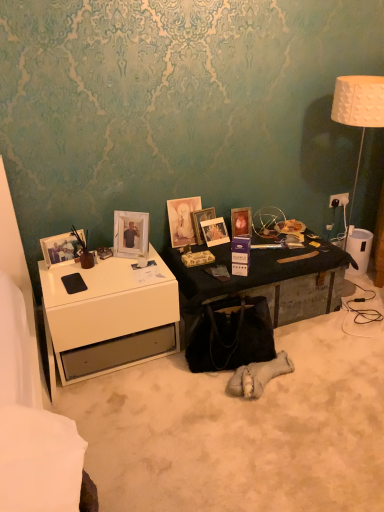
Question: Considering the positions of white plastic power outlet at upper right and matte glass picture frame at center, marked as the 3th picture frame in a left-to-right arrangement, in the image, is white plastic power outlet at upper right taller or shorter than matte glass picture frame at center, marked as the 3th picture frame in a left-to-right arrangement,?

Choices:
 (A) tall
 (B) short

Answer: (B)

Question: In the image, is white plastic power outlet at upper right on the left side or the right side of matte glass picture frame at center, marked as the 3th picture frame in a left-to-right arrangement?

Choices:
 (A) left
 (B) right

Answer: (B)

Question: Estimate the real-world distances between objects in this image. Which object is closer to the wooden photo frame at center, the fifth picture frame positioned from the left?

Choices:
 (A) metallic black trunk at center
 (B) matte glass picture frame at center, which is counted as the fourth picture frame, starting from the right
 (C) white glossy picture frame at upper left, arranged as the second picture frame when viewed from the left
 (D) white glossy desk at left
 (E) matte wooden picture frame at center, arranged as the 6th picture frame when viewed from the left

Answer: (E)

Question: Considering the real-world distances, which object is farthest from the white glossy desk at left?

Choices:
 (A) matte wooden picture frame at center, arranged as the 6th picture frame when viewed from the left
 (B) metallic black trunk at center
 (C) white plastic power outlet at upper right
 (D) matte wooden picture frame at center, which is the third picture frame from right to left
 (E) wooden photo frame at center, the 2th picture frame positioned from the right

Answer: (C)